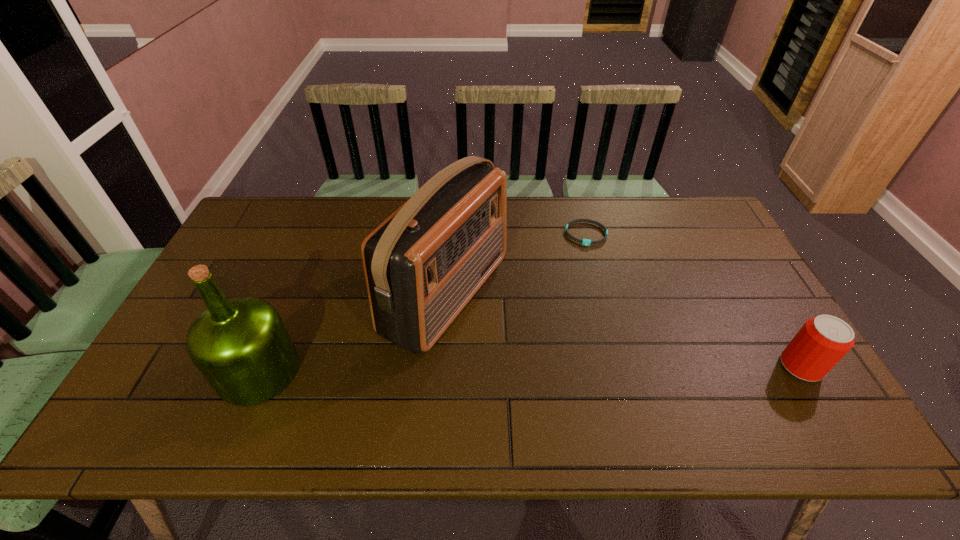
The width and height of the screenshot is (960, 540). What are the coordinates of `olive oil` in the screenshot? It's located at (241, 346).

At what (x,y) coordinates should I click in order to perform the action: click on beer can. Please return your answer as a coordinate pair (x, y). The height and width of the screenshot is (540, 960). Looking at the image, I should click on (822, 342).

Locate an element on the screen. The height and width of the screenshot is (540, 960). the second shortest object is located at coordinates (822, 342).

At what (x,y) coordinates should I click in order to perform the action: click on radio receiver. Please return your answer as a coordinate pair (x, y). Looking at the image, I should click on (423, 264).

Find the location of a particular element. This screenshot has height=540, width=960. the shortest object is located at coordinates (586, 242).

I want to click on wristband, so click(x=586, y=242).

You are a GUI agent. You are given a task and a screenshot of the screen. Output one action in this format:
    pyautogui.click(x=<x>, y=<y>)
    Task: Click on the free space located 0.060m on the right of the leftmost object
    The image size is (960, 540).
    Given the screenshot: What is the action you would take?
    pyautogui.click(x=323, y=371)

Identify the location of free location located on the back of the rightmost object. (770, 314).

Image resolution: width=960 pixels, height=540 pixels. In order to click on free point located on the front-facing side of the radio receiver in this screenshot , I will do `click(629, 386)`.

Identify the location of free space located 0.390m on the front-facing side of the radio receiver. (645, 393).